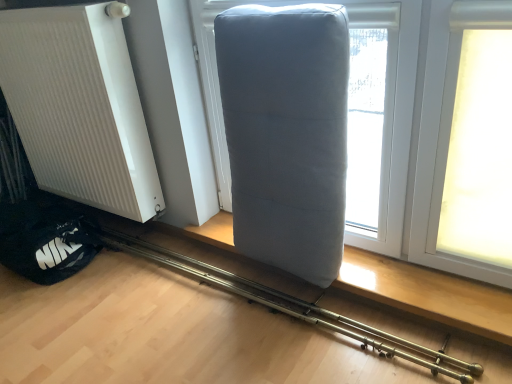
Locate an element on the screen. The image size is (512, 384). vacant region below matte gray pillow at center (from a real-world perspective) is located at coordinates (252, 293).